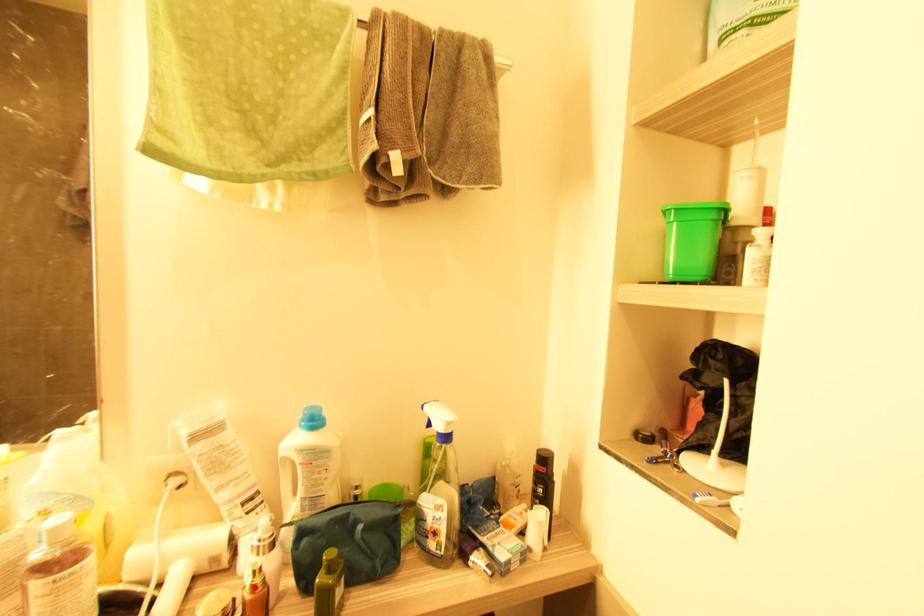
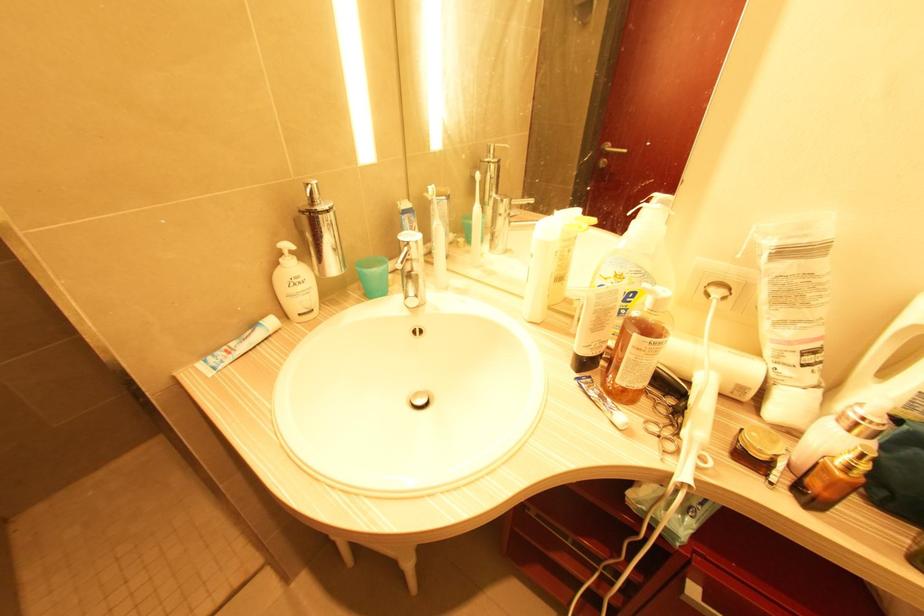
The point at the highlighted location is marked in the first image. Where is the corresponding point in the second image?

(850, 468)